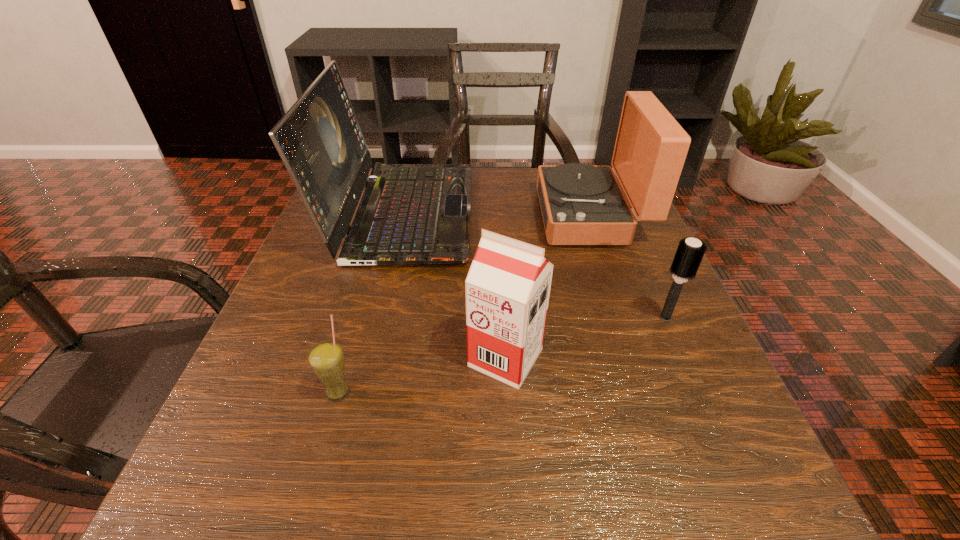
What are the coordinates of `vacant region located on the left of the third nearest object` in the screenshot? It's located at (435, 318).

Identify the location of free spot located on the left of the straw for drinking. (280, 392).

Where is `laptop computer at the far edge`? laptop computer at the far edge is located at coordinates (410, 214).

This screenshot has width=960, height=540. What are the coordinates of `phonograph record located at the far edge` in the screenshot? It's located at (581, 204).

Find the location of `laptop computer located at the left edge`. laptop computer located at the left edge is located at coordinates point(410,214).

Where is `straw for drinking that is at the left edge`? straw for drinking that is at the left edge is located at coordinates (326, 359).

Where is `phonograph record located at the right edge`? Image resolution: width=960 pixels, height=540 pixels. phonograph record located at the right edge is located at coordinates (581, 204).

The width and height of the screenshot is (960, 540). Identify the location of hairbrush that is at the right edge. (690, 252).

Locate an element on the screen. The image size is (960, 540). object situated at the far left corner is located at coordinates (410, 214).

Identify the location of object positioned at the far right corner. (581, 204).